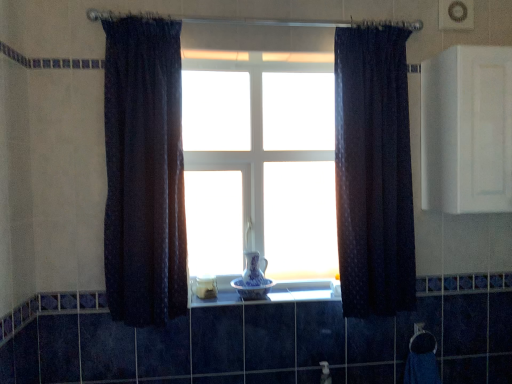
Consider the image. What is the approximate width of blue porcelain vase at center, which ranks as the first glass vase in bottom-to-top order?

It is 8.32 inches.

What is the approximate width of white glossy bowl at center?

white glossy bowl at center is 9.17 inches wide.

The height and width of the screenshot is (384, 512). Describe the element at coordinates (144, 172) in the screenshot. I see `dark textured curtain at left, placed as the 1th curtain when sorted from left to right` at that location.

The height and width of the screenshot is (384, 512). I want to click on blue porcelain vase at center, the 2th glass vase positioned from the top, so click(x=253, y=278).

I want to click on medicine cabinet above the blue porcelain vase at center, marked as the 2th glass vase in a bottom-to-top arrangement (from the image's perspective), so click(467, 130).

Does blue porcelain vase at center, the first glass vase in the top-to-bottom sequence, have a lesser width compared to white matte cabinet at upper right?

Yes.

Does point (253, 253) appear closer or farther from the camera than point (422, 181)?

Clearly, point (253, 253) is more distant from the camera than point (422, 181).

Is blue porcelain vase at center, marked as the 2th glass vase in a bottom-to-top arrangement, with white matte cabinet at upper right?

No, blue porcelain vase at center, marked as the 2th glass vase in a bottom-to-top arrangement, is not with white matte cabinet at upper right.

What's the angular difference between dark textured curtain at left, placed as the 1th curtain when sorted from left to right, and white glass vase at center's facing directions?

The angular difference between dark textured curtain at left, placed as the 1th curtain when sorted from left to right, and white glass vase at center is 0.913 degrees.

Considering the positions of point (142, 175) and point (240, 194), is point (142, 175) closer or farther from the camera than point (240, 194)?

Clearly, point (142, 175) is closer to the camera than point (240, 194).

Is dark textured curtain at left, placed as the 1th curtain when sorted from left to right, bigger than white glass vase at center?

Yes.

Locate an element on the screen. This screenshot has height=384, width=512. bay window above the blue porcelain vase at center, the first glass vase in the top-to-bottom sequence (from a real-world perspective) is located at coordinates (261, 168).

Between blue porcelain vase at center, marked as the 2th glass vase in a bottom-to-top arrangement, and white glass vase at center, which one has larger width?

blue porcelain vase at center, marked as the 2th glass vase in a bottom-to-top arrangement, is wider.

Based on the photo, how different are the orientations of blue porcelain vase at center, the first glass vase in the top-to-bottom sequence, and white glass vase at center in degrees?

There is a 1.93-degree angle between the facing directions of blue porcelain vase at center, the first glass vase in the top-to-bottom sequence, and white glass vase at center.

From a real-world perspective, relative to white glass vase at center, is blue porcelain vase at center, the first glass vase in the top-to-bottom sequence, vertically above or below?

blue porcelain vase at center, the first glass vase in the top-to-bottom sequence, is situated lower than white glass vase at center in the real world.

Is point (247, 279) less distant than point (199, 259)?

Yes, it is in front of point (199, 259).

Does blue porcelain vase at center, which ranks as the first glass vase in bottom-to-top order, have a greater height compared to white glass vase at center?

In fact, blue porcelain vase at center, which ranks as the first glass vase in bottom-to-top order, may be shorter than white glass vase at center.

From a real-world perspective, which object stands above the other?

white glass vase at center.

Starting from the white glass vase at center, which glass vase is the 2nd one in front? Please provide its 2D coordinates.

[(253, 278)]

Between white glossy bowl at center and blue porcelain vase at center, the first glass vase in the top-to-bottom sequence, which one has less height?

With less height is white glossy bowl at center.

What's the angular difference between white glossy bowl at center and blue porcelain vase at center, marked as the 2th glass vase in a bottom-to-top arrangement,'s facing directions?

The angular difference between white glossy bowl at center and blue porcelain vase at center, marked as the 2th glass vase in a bottom-to-top arrangement, is 1.87 degrees.

Consider the image. Would you say white glossy bowl at center is to the left or to the right of blue porcelain vase at center, marked as the 2th glass vase in a bottom-to-top arrangement, in the picture?

In the image, white glossy bowl at center appears on the right side of blue porcelain vase at center, marked as the 2th glass vase in a bottom-to-top arrangement.

From the image's perspective, is white glossy bowl at center located above or below blue porcelain vase at center, marked as the 2th glass vase in a bottom-to-top arrangement?

white glossy bowl at center is situated lower than blue porcelain vase at center, marked as the 2th glass vase in a bottom-to-top arrangement, in the image.

Is white glass vase at center positioned beyond the bounds of dark blue textured curtain at center, which is the 2th curtain from left to right?

Yes, white glass vase at center is located beyond the bounds of dark blue textured curtain at center, which is the 2th curtain from left to right.

In the scene shown: In the image, is white glass vase at center positioned in front of or behind dark blue textured curtain at center, which is the 2th curtain from left to right?

white glass vase at center is positioned farther from the viewer than dark blue textured curtain at center, which is the 2th curtain from left to right.

How distant is white glass vase at center from dark blue textured curtain at center, which is the 1th curtain from right to left?

A distance of 43.28 centimeters exists between white glass vase at center and dark blue textured curtain at center, which is the 1th curtain from right to left.

From the image's perspective, which is below, white glass vase at center or dark blue textured curtain at center, which is the 2th curtain from left to right?

From the image's view, white glass vase at center is below.

Between blue porcelain vase at center, the 2th glass vase positioned from the top, and white glossy bowl at center, which one has more height?

Standing taller between the two is blue porcelain vase at center, the 2th glass vase positioned from the top.

In the scene shown: From the image's perspective, which is below, blue porcelain vase at center, the 2th glass vase positioned from the top, or white glossy bowl at center?

From the image's view, white glossy bowl at center is below.

Visually, is blue porcelain vase at center, the 2th glass vase positioned from the top, positioned to the left or to the right of white glossy bowl at center?

blue porcelain vase at center, the 2th glass vase positioned from the top, is positioned on white glossy bowl at center's left side.

From a real-world perspective, is blue porcelain vase at center, the 2th glass vase positioned from the top, beneath white glossy bowl at center?

No, from a real-world perspective, blue porcelain vase at center, the 2th glass vase positioned from the top, is not under white glossy bowl at center.

Identify the location of medicine cabinet lying in front of the blue porcelain vase at center, the first glass vase in the top-to-bottom sequence. The image size is (512, 384). (467, 130).

Where is `bay window behind the dark textured curtain at left, acting as the 2th curtain starting from the right`? This screenshot has width=512, height=384. bay window behind the dark textured curtain at left, acting as the 2th curtain starting from the right is located at coordinates (261, 168).

From the picture: Looking at the image, which one is located further to white matte cabinet at upper right, dark textured curtain at left, acting as the 2th curtain starting from the right, or blue porcelain vase at center, which ranks as the first glass vase in bottom-to-top order?

dark textured curtain at left, acting as the 2th curtain starting from the right, is further to white matte cabinet at upper right.

Which object lies nearer to the anchor point blue porcelain vase at center, the first glass vase in the top-to-bottom sequence, blue porcelain vase at center, the 2th glass vase positioned from the top, or white glass vase at center?

blue porcelain vase at center, the 2th glass vase positioned from the top, lies closer to blue porcelain vase at center, the first glass vase in the top-to-bottom sequence, than the other object.

Estimate the real-world distances between objects in this image. Which object is closer to white glass vase at center, dark textured curtain at left, acting as the 2th curtain starting from the right, or blue porcelain vase at center, marked as the 2th glass vase in a bottom-to-top arrangement?

Among the two, blue porcelain vase at center, marked as the 2th glass vase in a bottom-to-top arrangement, is located nearer to white glass vase at center.

Estimate the real-world distances between objects in this image. Which object is closer to dark textured curtain at left, placed as the 1th curtain when sorted from left to right, white glass vase at center or dark blue textured curtain at center, which is the 2th curtain from left to right?

white glass vase at center is closer to dark textured curtain at left, placed as the 1th curtain when sorted from left to right.

Estimate the real-world distances between objects in this image. Which object is further from blue porcelain vase at center, the 2th glass vase positioned from the top, white glossy bowl at center or white matte cabinet at upper right?

Based on the image, white matte cabinet at upper right appears to be further to blue porcelain vase at center, the 2th glass vase positioned from the top.

Based on the photo, looking at the image, which one is located closer to white glass vase at center, white glossy bowl at center or dark textured curtain at left, placed as the 1th curtain when sorted from left to right?

dark textured curtain at left, placed as the 1th curtain when sorted from left to right, is positioned closer to the anchor white glass vase at center.

Looking at the image, which one is located closer to white matte cabinet at upper right, blue porcelain vase at center, the 2th glass vase positioned from the top, or blue porcelain vase at center, the first glass vase in the top-to-bottom sequence?

Based on the image, blue porcelain vase at center, the 2th glass vase positioned from the top, appears to be nearer to white matte cabinet at upper right.

Looking at the image, which one is located further to white glass vase at center, blue porcelain vase at center, the 2th glass vase positioned from the top, or dark textured curtain at left, acting as the 2th curtain starting from the right?

dark textured curtain at left, acting as the 2th curtain starting from the right, is further to white glass vase at center.

What are the coordinates of `glass vase between blue porcelain vase at center, the 2th glass vase positioned from the top, and dark blue textured curtain at center, which is the 1th curtain from right to left` in the screenshot? It's located at (254, 270).

The image size is (512, 384). In order to click on glass vase between blue porcelain vase at center, the first glass vase in the top-to-bottom sequence, and white glossy bowl at center from top to bottom in this screenshot , I will do `click(253, 278)`.

Identify the location of window sill between blue porcelain vase at center, the 2th glass vase positioned from the top, and white matte cabinet at upper right from left to right. (276, 294).

Where is `bay window between dark blue textured curtain at center, which is the 1th curtain from right to left, and white glossy bowl at center in the up-down direction`? bay window between dark blue textured curtain at center, which is the 1th curtain from right to left, and white glossy bowl at center in the up-down direction is located at coordinates (261, 168).